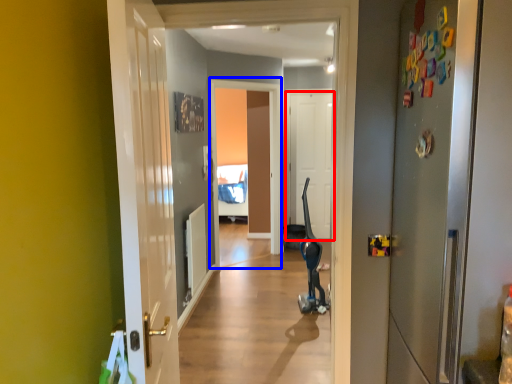
Question: Which of the following is the farthest to the observer, door (highlighted by a red box) or screen door (highlighted by a blue box)?

Choices:
 (A) door
 (B) screen door

Answer: (A)